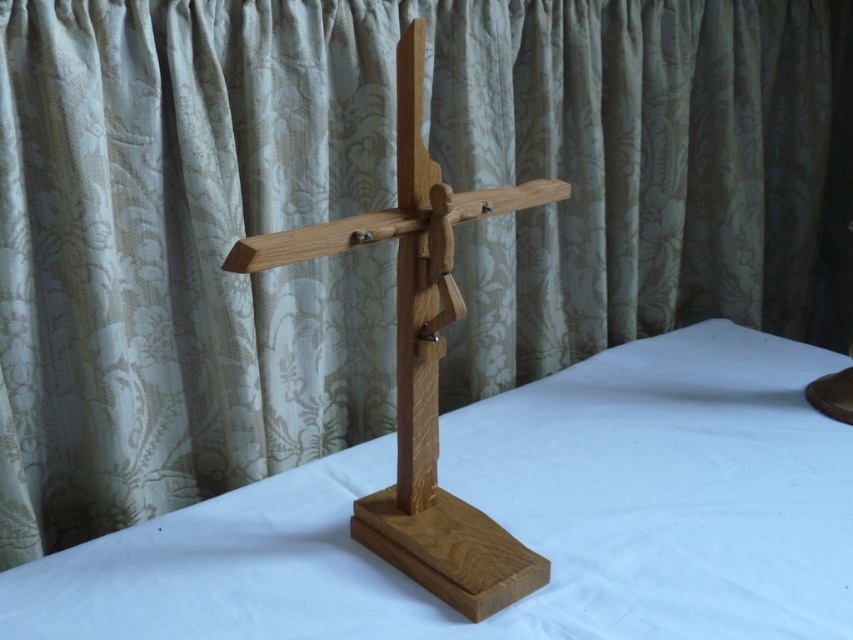
Which is more to the left, natural wood table at center or natural wood crucifix at center?

natural wood crucifix at center

Does natural wood table at center have a lesser width compared to natural wood crucifix at center?

Incorrect, natural wood table at center's width is not less than natural wood crucifix at center's.

Does point (64, 595) come farther from viewer compared to point (425, 480)?

No.

Locate an element on the screen. This screenshot has height=640, width=853. natural wood table at center is located at coordinates coord(520,516).